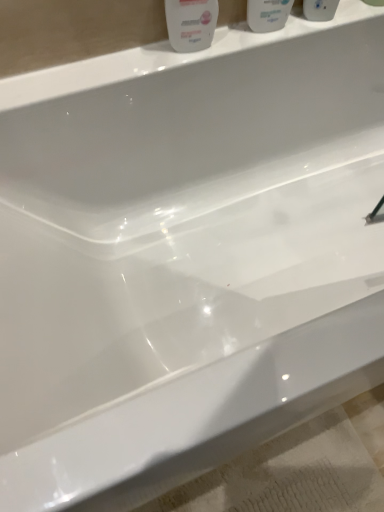
Where is `vacant space to the left of white glossy mouthwash at upper center, the 1th mouthwash in the left-to-right sequence`? vacant space to the left of white glossy mouthwash at upper center, the 1th mouthwash in the left-to-right sequence is located at coordinates (196, 47).